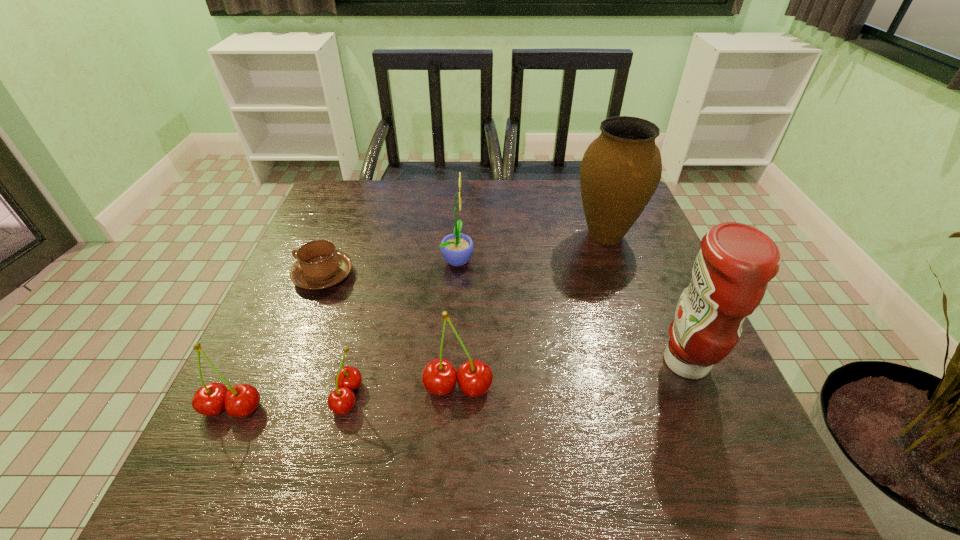
Image resolution: width=960 pixels, height=540 pixels. I want to click on the second tallest cherry, so click(x=241, y=400).

Find the location of `the third shortest object`. the third shortest object is located at coordinates (241, 400).

Identify the location of the third object from left to right. This screenshot has height=540, width=960. (342, 400).

You are a GUI agent. You are given a task and a screenshot of the screen. Output one action in this format:
    pyautogui.click(x=<x>, y=<y>)
    Task: Click on the second cherry from left to right
    Image resolution: width=960 pixels, height=540 pixels.
    Given the screenshot: What is the action you would take?
    pyautogui.click(x=342, y=400)

Identify the location of the rightmost cherry. This screenshot has width=960, height=540. coord(439,377).

In order to click on sunflower in this screenshot , I will do `click(457, 249)`.

Identify the location of urn. (620, 171).

What are the coordinates of `cappuccino` in the screenshot? It's located at (319, 265).

I want to click on condiment, so click(730, 275).

Find the location of a particular element. This screenshot has width=960, height=540. vacant space situated 0.050m with the stems of the sixth tallest object pointing upwards is located at coordinates (306, 397).